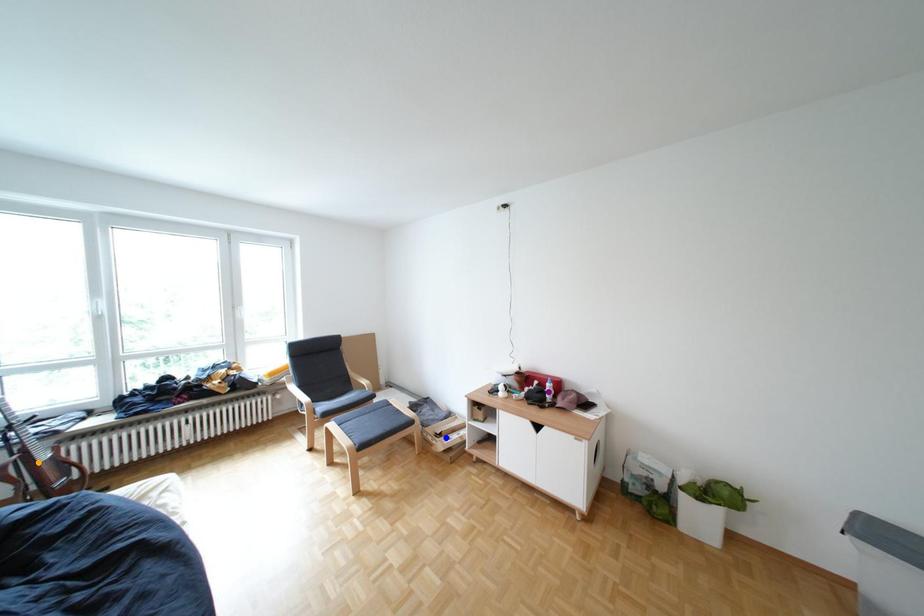
Order these from nearest to farthest:
A) orange point
B) blue point
C) purple point

1. orange point
2. purple point
3. blue point